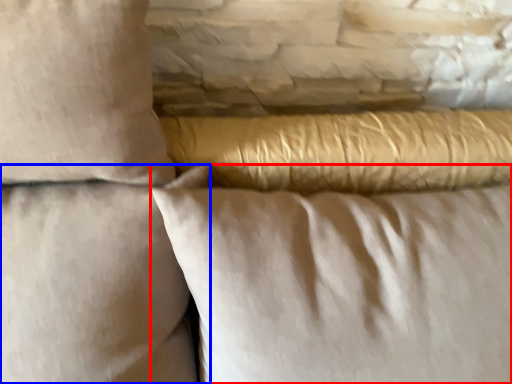
Question: Among these objects, which one is nearest to the camera, pillow (highlighted by a red box) or pillow (highlighted by a blue box)?

Choices:
 (A) pillow
 (B) pillow

Answer: (B)